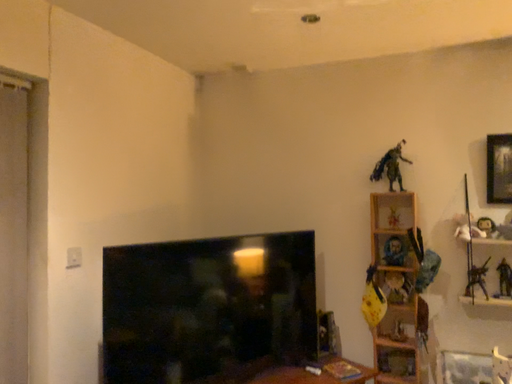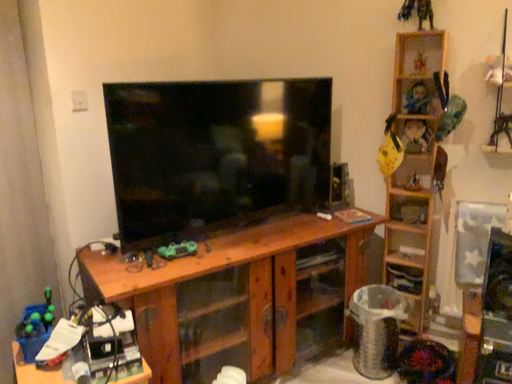
Question: Which way did the camera rotate in the video?

Choices:
 (A) rotated upward
 (B) rotated downward

Answer: (B)